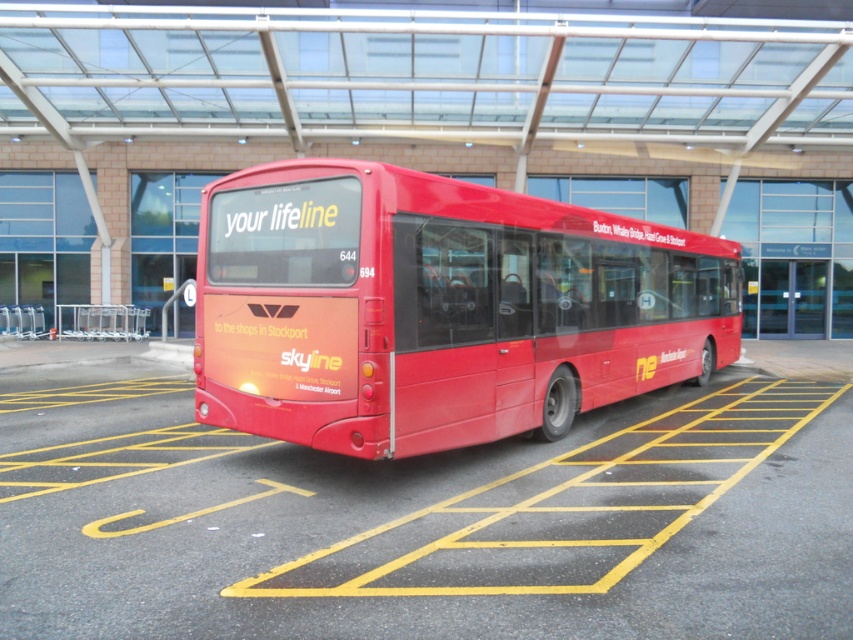
Question: Which of the following is the closest to the observer?

Choices:
 (A) (511, 573)
 (B) (520, 269)

Answer: (A)

Question: Is the position of smooth asphalt parking lot at center less distant than that of matte red bus at center?

Choices:
 (A) no
 (B) yes

Answer: (B)

Question: Is smooth asphalt parking lot at center closer to the viewer compared to matte red bus at center?

Choices:
 (A) yes
 (B) no

Answer: (A)

Question: Which point is closer to the camera?

Choices:
 (A) (390, 428)
 (B) (175, 403)

Answer: (A)

Question: Is smooth asphalt parking lot at center above matte red bus at center?

Choices:
 (A) yes
 (B) no

Answer: (B)